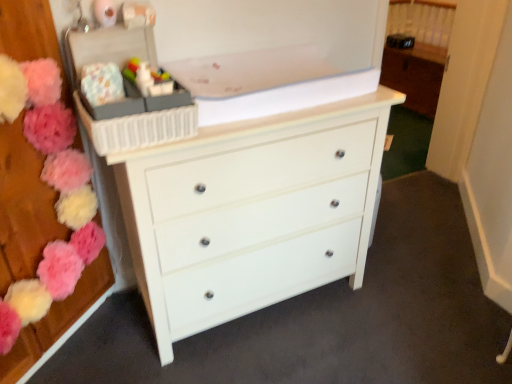
Question: Does white glossy chest of drawers at center come behind fluffy fabric flowers at left, which appears as the first flower when viewed from the left?

Choices:
 (A) yes
 (B) no

Answer: (A)

Question: Does white glossy chest of drawers at center have a lesser width compared to fluffy fabric flowers at left, marked as the 2th flower in a right-to-left arrangement?

Choices:
 (A) no
 (B) yes

Answer: (A)

Question: Considering the relative sizes of white glossy chest of drawers at center and fluffy fabric flowers at left, which appears as the first flower when viewed from the left, in the image provided, is white glossy chest of drawers at center smaller than fluffy fabric flowers at left, which appears as the first flower when viewed from the left,?

Choices:
 (A) no
 (B) yes

Answer: (A)

Question: Is white glossy chest of drawers at center wider than fluffy fabric flowers at left, marked as the 2th flower in a right-to-left arrangement?

Choices:
 (A) no
 (B) yes

Answer: (B)

Question: Is white glossy chest of drawers at center placed right next to fluffy fabric flowers at left, which appears as the first flower when viewed from the left?

Choices:
 (A) yes
 (B) no

Answer: (B)

Question: Does white glossy chest of drawers at center contain fluffy fabric flowers at left, marked as the 2th flower in a right-to-left arrangement?

Choices:
 (A) yes
 (B) no

Answer: (B)

Question: Are fluffy fabric flowers at left, which appears as the first flower when viewed from the left, and plastic storage box at upper left located far from each other?

Choices:
 (A) no
 (B) yes

Answer: (A)

Question: Does fluffy fabric flowers at left, marked as the 2th flower in a right-to-left arrangement, touch plastic storage box at upper left?

Choices:
 (A) yes
 (B) no

Answer: (B)

Question: Is fluffy fabric flowers at left, which appears as the first flower when viewed from the left, taller than plastic storage box at upper left?

Choices:
 (A) no
 (B) yes

Answer: (B)

Question: From the image's perspective, is fluffy fabric flowers at left, marked as the 2th flower in a right-to-left arrangement, on top of plastic storage box at upper left?

Choices:
 (A) no
 (B) yes

Answer: (A)

Question: From the image's perspective, is fluffy fabric flowers at left, marked as the 2th flower in a right-to-left arrangement, below plastic storage box at upper left?

Choices:
 (A) yes
 (B) no

Answer: (A)

Question: Does fluffy fabric flowers at left, which appears as the first flower when viewed from the left, appear on the right side of plastic storage box at upper left?

Choices:
 (A) no
 (B) yes

Answer: (A)

Question: Does white glossy chest of drawers at center lie in front of plastic storage box at upper left?

Choices:
 (A) no
 (B) yes

Answer: (B)